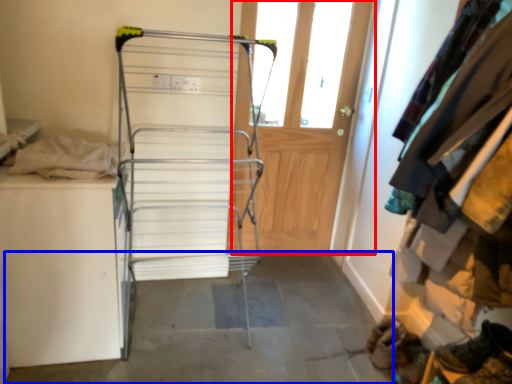
Question: Among these objects, which one is farthest to the camera, door (highlighted by a red box) or concrete (highlighted by a blue box)?

Choices:
 (A) door
 (B) concrete

Answer: (A)